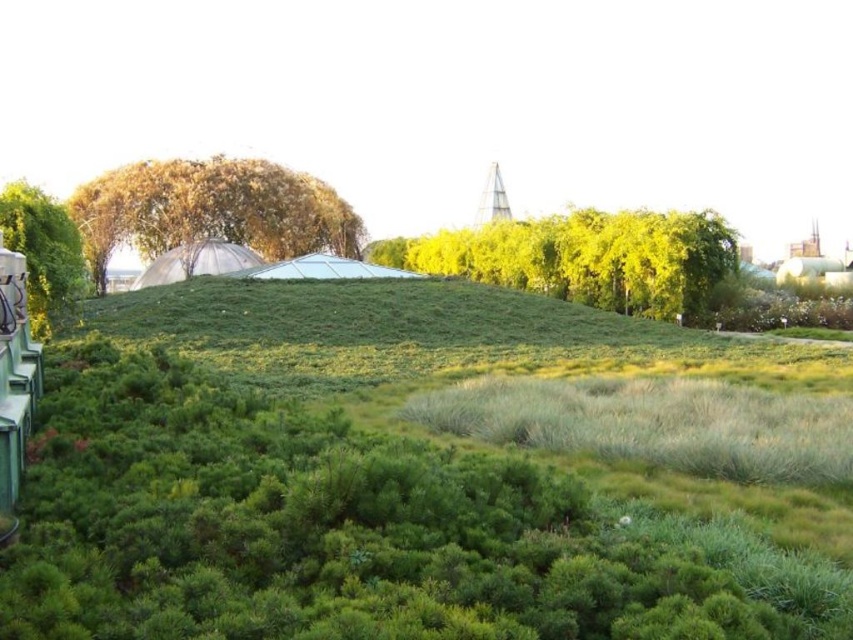
Can you confirm if green leafy tree at center is positioned above golden textured tree at upper left?

No, green leafy tree at center is not above golden textured tree at upper left.

Who is more forward, (547, 269) or (173, 244)?

Point (547, 269)

At what (x,y) coordinates should I click in order to perform the action: click on green leafy tree at center. Please return your answer as a coordinate pair (x, y). The width and height of the screenshot is (853, 640). Looking at the image, I should click on (585, 257).

Is golden textured tree at upper left positioned behind green leafy tree at left?

Yes.

How far apart are golden textured tree at upper left and green leafy tree at left?

A distance of 72.70 feet exists between golden textured tree at upper left and green leafy tree at left.

At what (x,y) coordinates should I click in order to perform the action: click on golden textured tree at upper left. Please return your answer as a coordinate pair (x, y). The width and height of the screenshot is (853, 640). Looking at the image, I should click on (209, 209).

Image resolution: width=853 pixels, height=640 pixels. I want to click on golden textured tree at upper left, so click(209, 209).

Is green leafy tree at center to the right of green leafy tree at left from the viewer's perspective?

Yes, green leafy tree at center is to the right of green leafy tree at left.

Between point (682, 284) and point (56, 211), which one is positioned behind?

Positioned behind is point (682, 284).

At what (x,y) coordinates should I click in order to perform the action: click on green leafy tree at center. Please return your answer as a coordinate pair (x, y). This screenshot has width=853, height=640. Looking at the image, I should click on (585, 257).